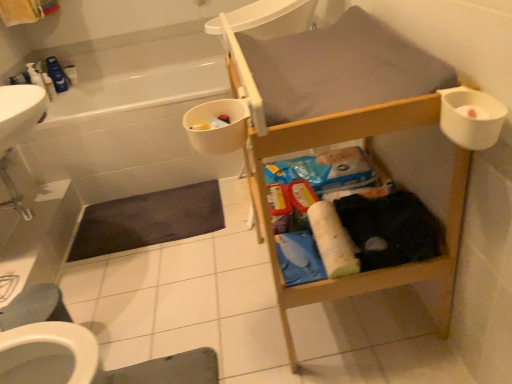
At what (x,y) coordinates should I click in order to perform the action: click on vacant space to the right of white plastic container at upper left, which is the first toiletry in back-to-front order. Please return your answer as a coordinate pair (x, y). Image resolution: width=512 pixels, height=384 pixels. Looking at the image, I should click on (96, 84).